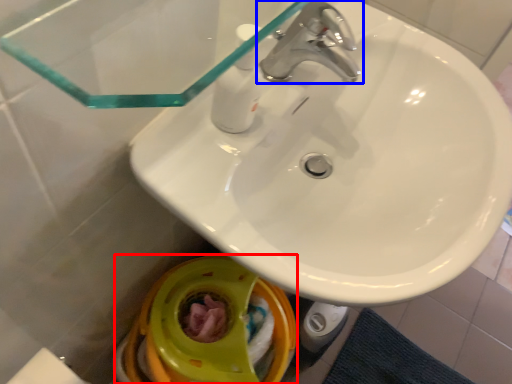
Question: Which object appears closest to the camera in this image, toilet bowl (highlighted by a red box) or tap (highlighted by a blue box)?

Choices:
 (A) toilet bowl
 (B) tap

Answer: (B)